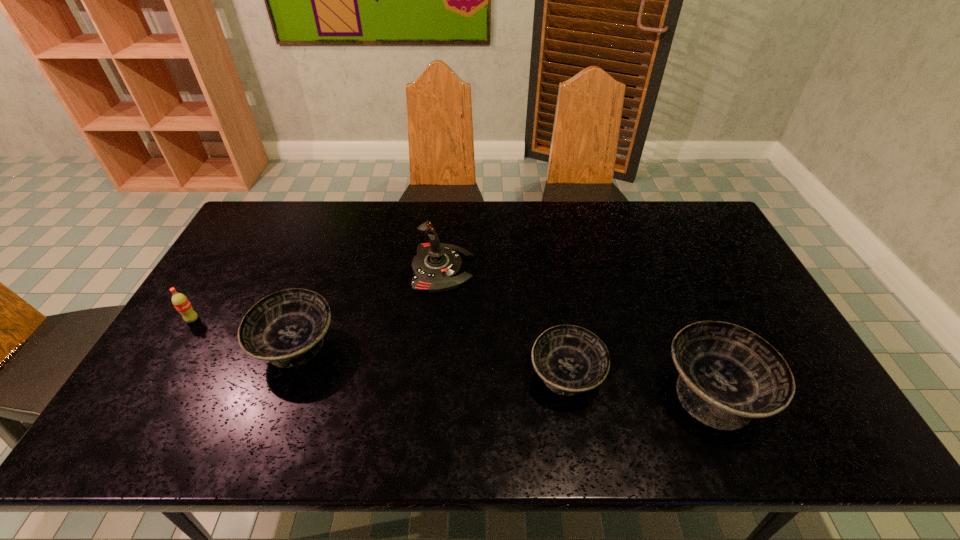
Locate an element on the screen. unoccupied position between the fifth tallest object and the third object from left to right is located at coordinates (504, 322).

Locate an element on the screen. The width and height of the screenshot is (960, 540). unoccupied area between the shortest object and the second shortest bowl is located at coordinates (501, 317).

Select which object appears as the fourth closest to the sunglasses. Please provide its 2D coordinates. Your answer should be formatted as a tuple, i.e. [(x, y)], where the tuple contains the x and y coordinates of a point satisfying the conditions above.

[(286, 328)]

Select which object is the fifth closest to the shortest object. Please provide its 2D coordinates. Your answer should be formatted as a tuple, i.e. [(x, y)], where the tuple contains the x and y coordinates of a point satisfying the conditions above.

[(180, 301)]

I want to click on the second closest bowl to the sunglasses, so click(570, 359).

Identify which bowl is the third closest to the third object from left to right. Please provide its 2D coordinates. Your answer should be formatted as a tuple, i.e. [(x, y)], where the tuple contains the x and y coordinates of a point satisfying the conditions above.

[(728, 375)]

Where is `free region that satisfies the following two spatial constraints: 1. on the handle side of the fourth object from right to left; 2. on the front side of the second shortest bowl`? The width and height of the screenshot is (960, 540). free region that satisfies the following two spatial constraints: 1. on the handle side of the fourth object from right to left; 2. on the front side of the second shortest bowl is located at coordinates (435, 347).

In order to click on blank space that satisfies the following two spatial constraints: 1. on the back side of the rightmost bowl; 2. on the handle side of the joystick in this screenshot , I will do `click(660, 268)`.

Locate an element on the screen. vacant area in the image that satisfies the following two spatial constraints: 1. on the handle side of the tallest object; 2. on the back side of the rightmost bowl is located at coordinates (431, 393).

At what (x,y) coordinates should I click in order to perform the action: click on free space that satisfies the following two spatial constraints: 1. on the handle side of the second shortest object; 2. on the left side of the joystick. Please return your answer as a coordinate pair (x, y). The height and width of the screenshot is (540, 960). Looking at the image, I should click on point(432,376).